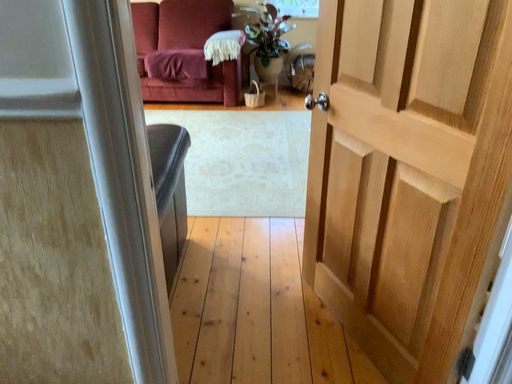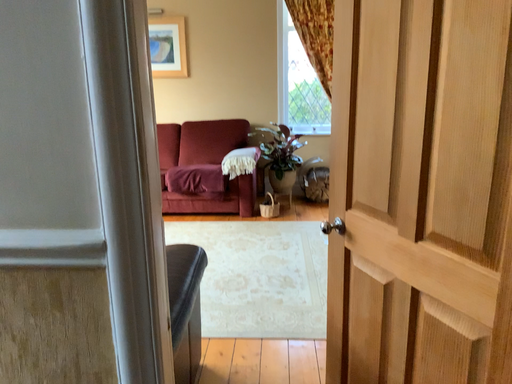
Question: Which way did the camera rotate in the video?

Choices:
 (A) rotated downward
 (B) rotated upward

Answer: (B)